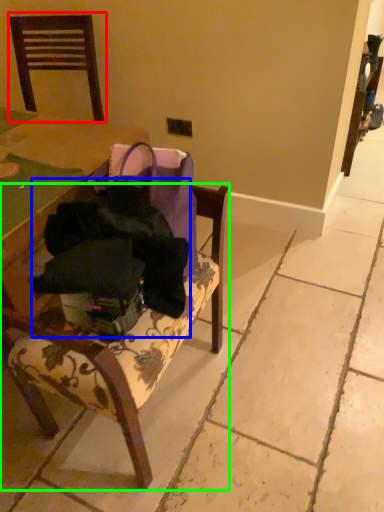
Question: Considering the real-world distances, which object is farthest from chair (highlighted by a red box)? clothing (highlighted by a blue box) or chair (highlighted by a green box)?

Choices:
 (A) clothing
 (B) chair

Answer: (A)